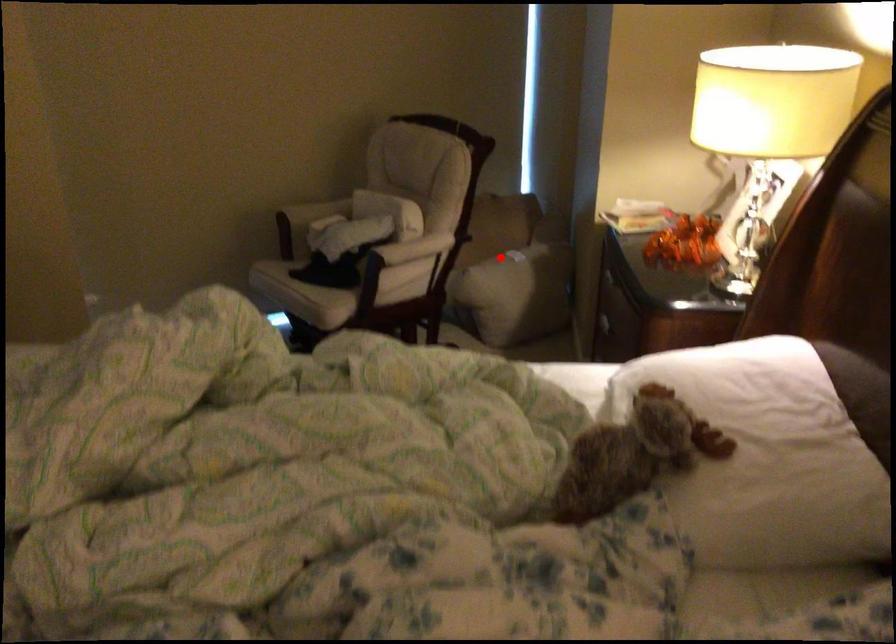
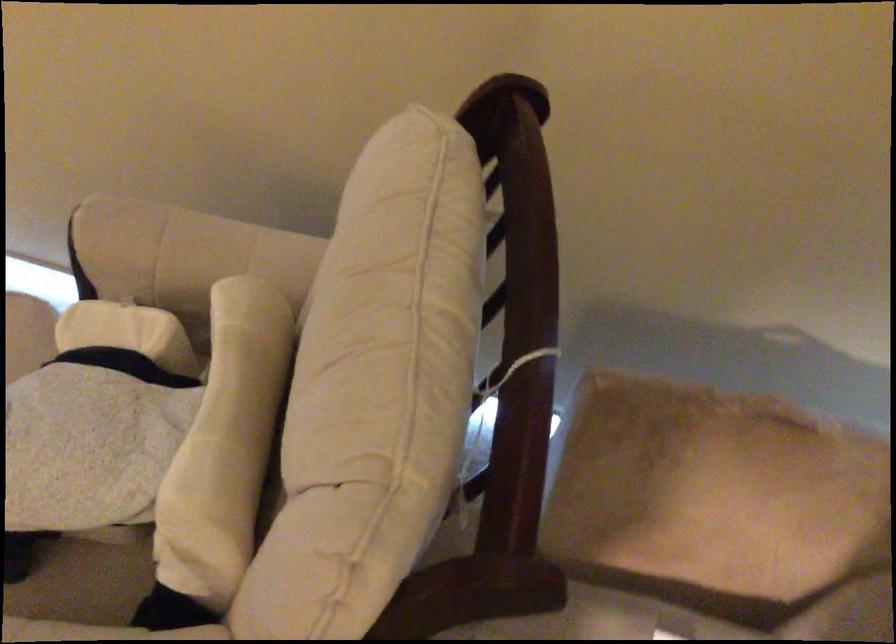
Locate, in the second image, the point that corresponds to the highlighted location in the first image.

(604, 621)